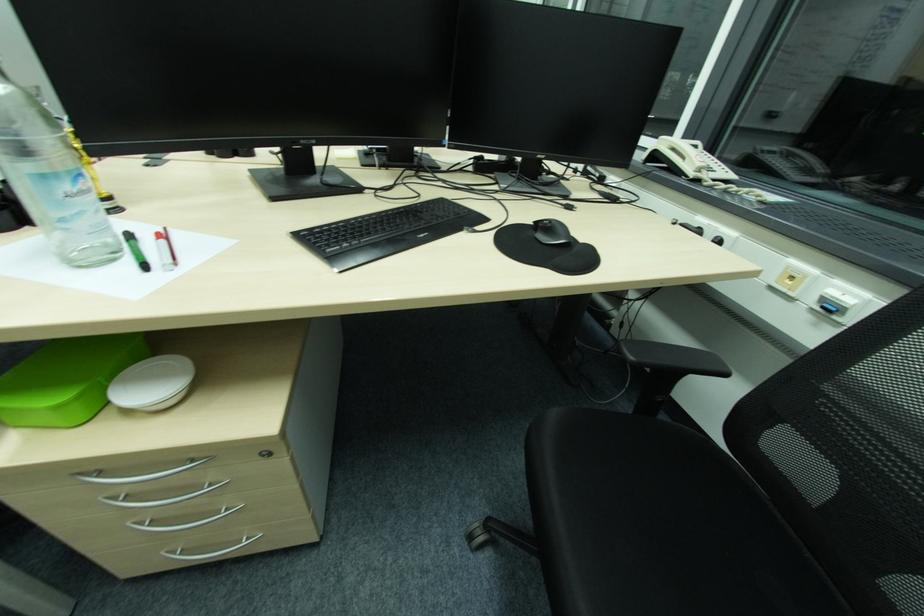
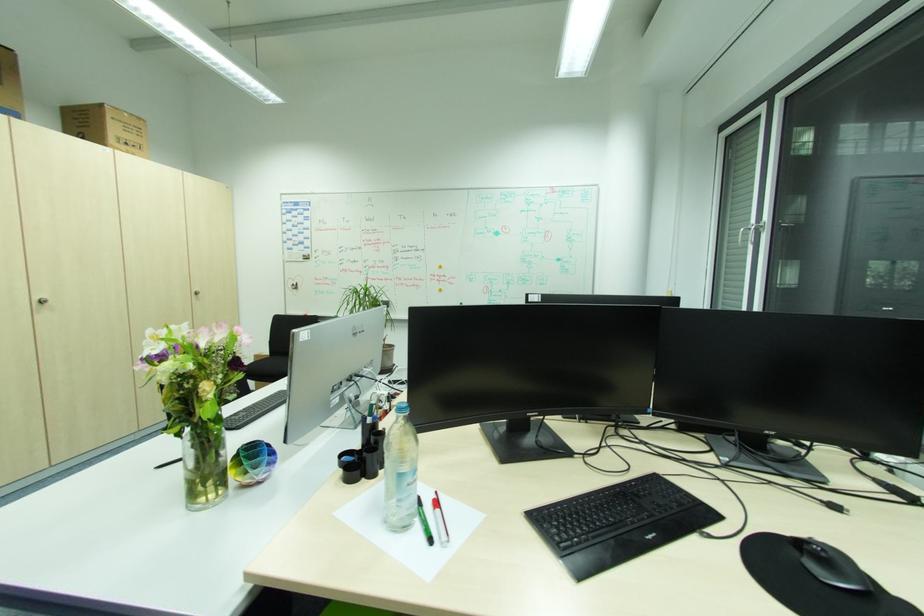
In the second image, find the point that corresponds to pixel 554 225 in the first image.

(829, 554)